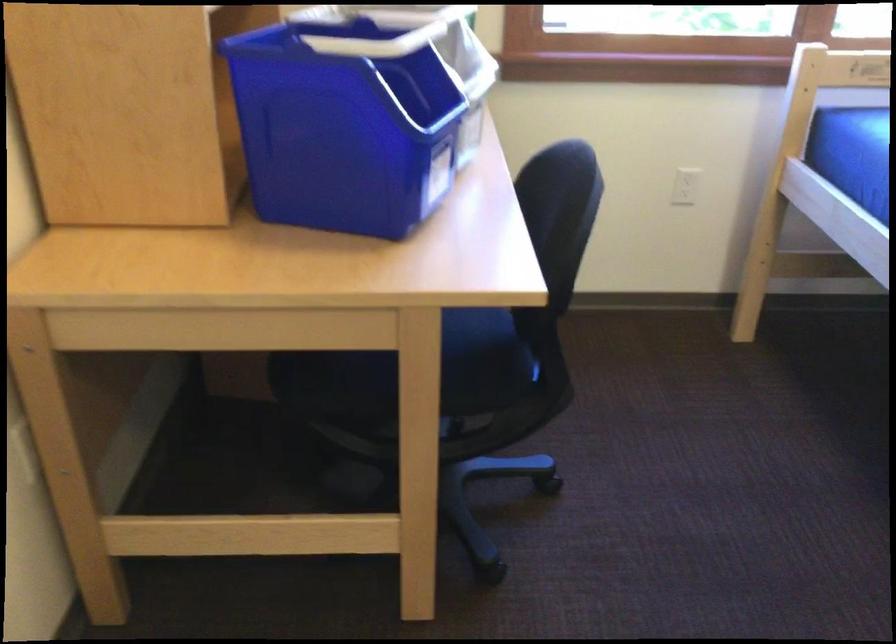
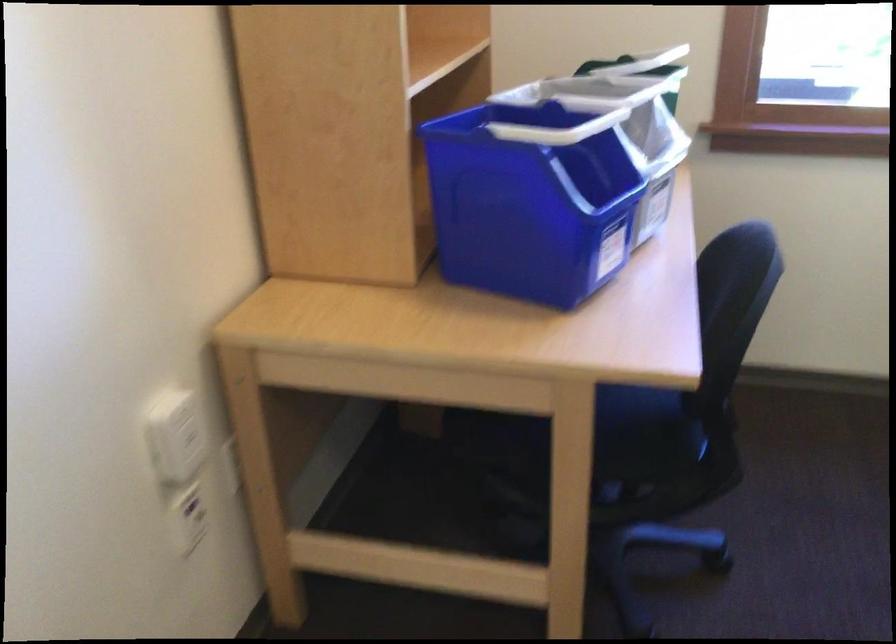
Where in the second image is the point corresponding to (468,348) from the first image?

(633, 415)